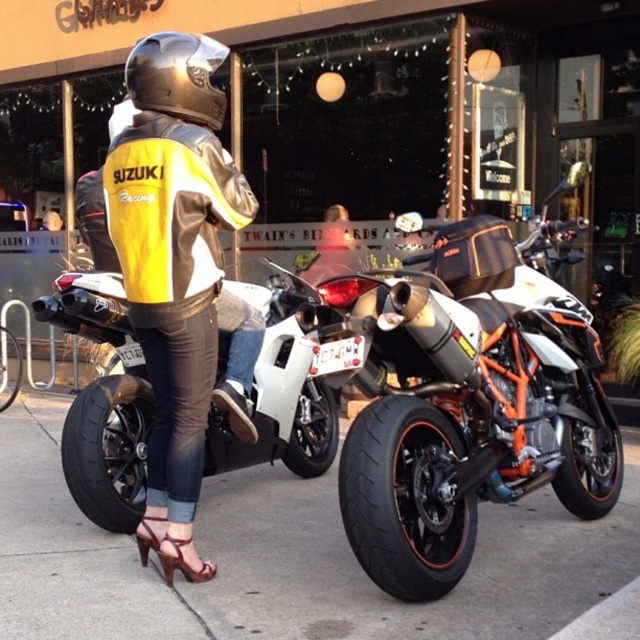
You are a delivery drone trying to land on the black asphalt pavement at lower center. What coordinates should you aim for?

The black asphalt pavement at lower center is located at point (292, 561), so you should aim for those coordinates to land safely.